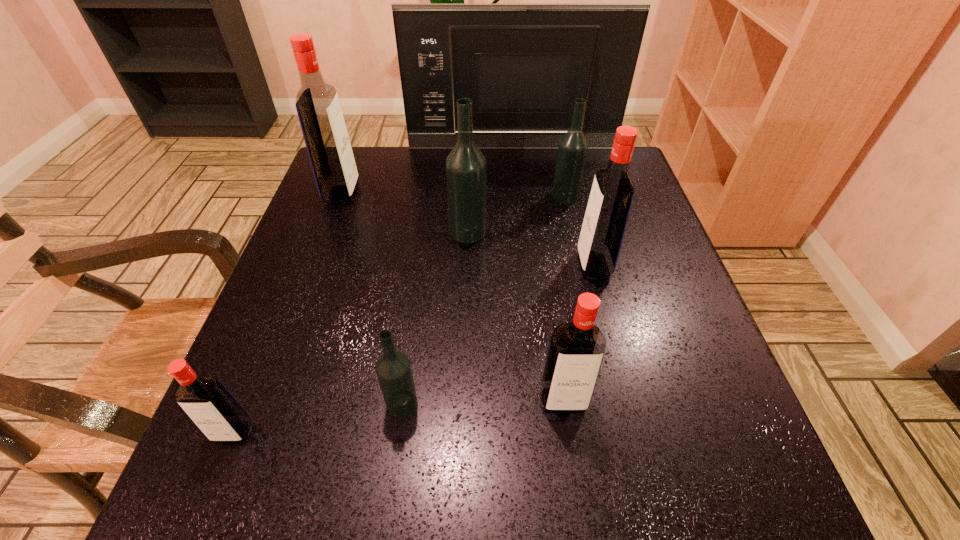
At what (x,y) coordinates should I click in order to perform the action: click on the seventh closest vodka to the farthest object. Please return your answer as a coordinate pair (x, y). Image resolution: width=960 pixels, height=540 pixels. Looking at the image, I should click on (208, 403).

The image size is (960, 540). What are the coordinates of `red vodka identified as the fourth closest to the farthest object` in the screenshot? It's located at (208, 403).

Select which red vodka is the second closest to the second farthest black vodka. Please provide its 2D coordinates. Your answer should be formatted as a tuple, i.e. [(x, y)], where the tuple contains the x and y coordinates of a point satisfying the conditions above.

[(317, 103)]

Where is `black vodka object that ranks as the second closest to the dark microwave oven`? The image size is (960, 540). black vodka object that ranks as the second closest to the dark microwave oven is located at coordinates (466, 169).

Choose which black vodka is the third nearest neighbor to the second farthest red vodka. Please provide its 2D coordinates. Your answer should be formatted as a tuple, i.e. [(x, y)], where the tuple contains the x and y coordinates of a point satisfying the conditions above.

[(393, 368)]

This screenshot has height=540, width=960. I want to click on free point that satisfies the following two spatial constraints: 1. on the front and back of the fourth vodka from right to left; 2. on the right side of the farthest red vodka, so click(x=327, y=232).

The width and height of the screenshot is (960, 540). Identify the location of free location that satisfies the following two spatial constraints: 1. on the front and back of the tallest vodka; 2. on the left side of the rightmost black vodka. (341, 196).

Find the location of `free space in the image that satisfies the following two spatial constraints: 1. on the front and back of the nearest black vodka; 2. on the left side of the farthest red vodka`. free space in the image that satisfies the following two spatial constraints: 1. on the front and back of the nearest black vodka; 2. on the left side of the farthest red vodka is located at coordinates (264, 403).